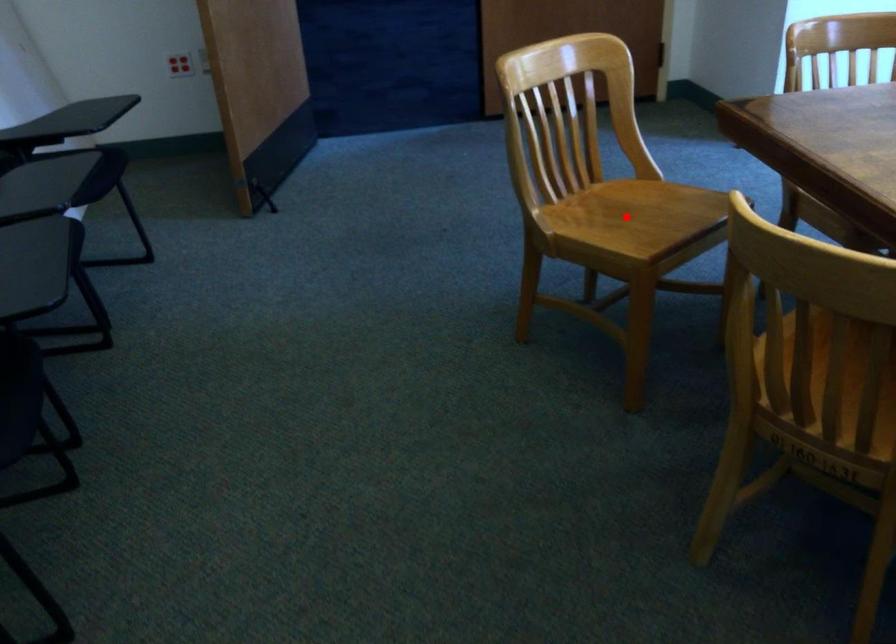
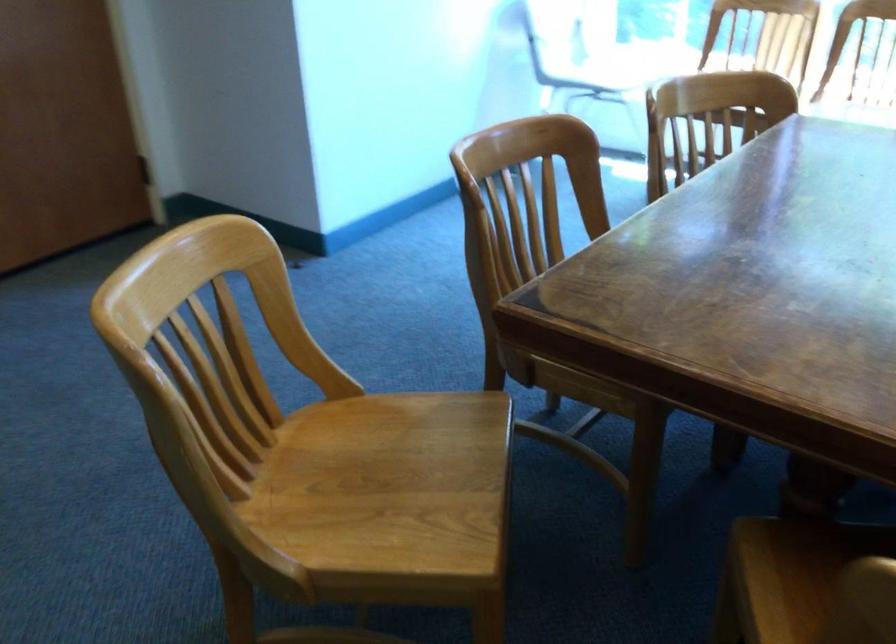
In the second image, find the point that corresponds to the highlighted location in the first image.

(383, 484)